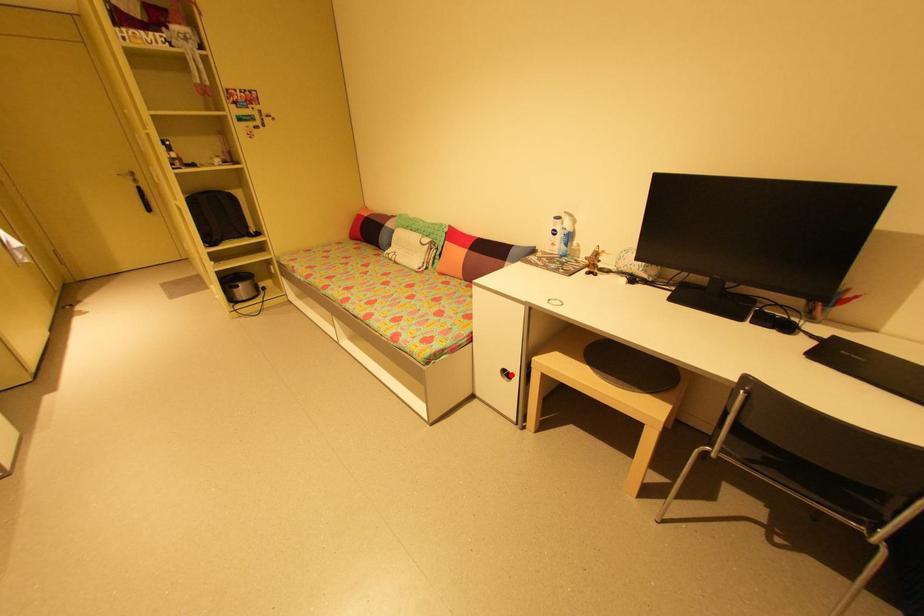
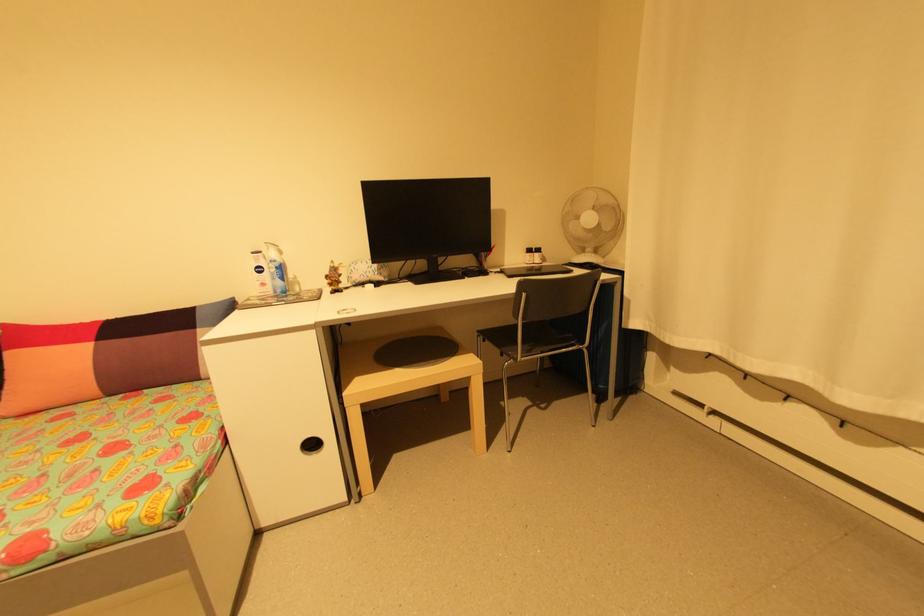
In the second image, find the point that corresponds to the highlighted location in the first image.

(317, 446)